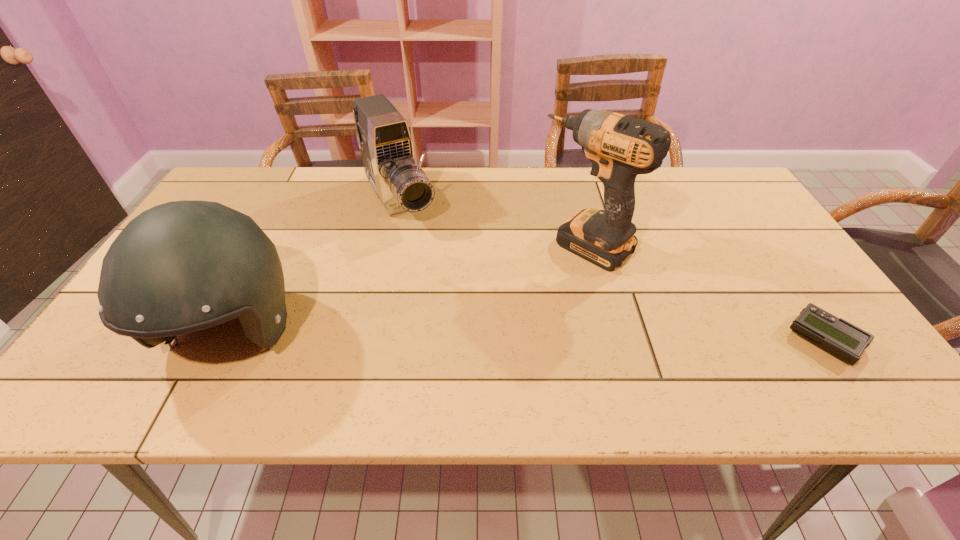
Find the location of a particular element. This screenshot has width=960, height=540. football helmet is located at coordinates click(182, 266).

This screenshot has height=540, width=960. What are the coordinates of `beeper` in the screenshot? It's located at (840, 338).

I want to click on the rightmost object, so click(x=840, y=338).

Where is `the third tallest object`? This screenshot has width=960, height=540. the third tallest object is located at coordinates (383, 136).

This screenshot has width=960, height=540. What are the coordinates of `the third object from right to left` in the screenshot? It's located at (383, 136).

Find the location of `the second object from right to left`. the second object from right to left is located at coordinates (620, 147).

The height and width of the screenshot is (540, 960). I want to click on vacant space situated on the back of the shortest object, so click(x=785, y=282).

Where is `blank area located 0.330m at the front of the second shortest object, highlighting the lens`? This screenshot has height=540, width=960. blank area located 0.330m at the front of the second shortest object, highlighting the lens is located at coordinates (462, 313).

Locate an element on the screen. vacant space situated 0.200m at the front of the second shortest object, highlighting the lens is located at coordinates (440, 278).

The height and width of the screenshot is (540, 960). Identify the location of free space located 0.310m at the front of the second shortest object, highlighting the lens. (458, 307).